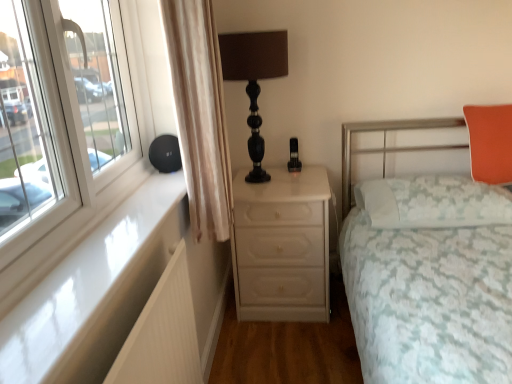
Locate an element on the screen. vacant space underneath black glossy table lamp at upper center (from a real-world perspective) is located at coordinates (256, 178).